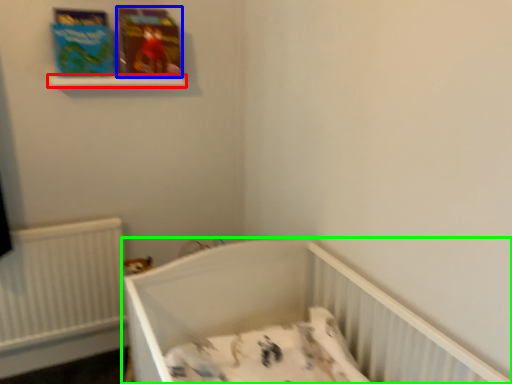
Question: Estimate the real-world distances between objects in this image. Which object is farther from balustrade (highlighted by a red box), paperback book (highlighted by a blue box) or infant bed (highlighted by a green box)?

Choices:
 (A) paperback book
 (B) infant bed

Answer: (B)